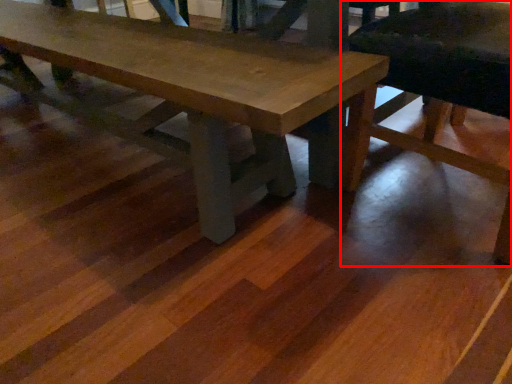
Question: In this image, where is chair (annotated by the red box) located relative to table?

Choices:
 (A) right
 (B) left

Answer: (A)